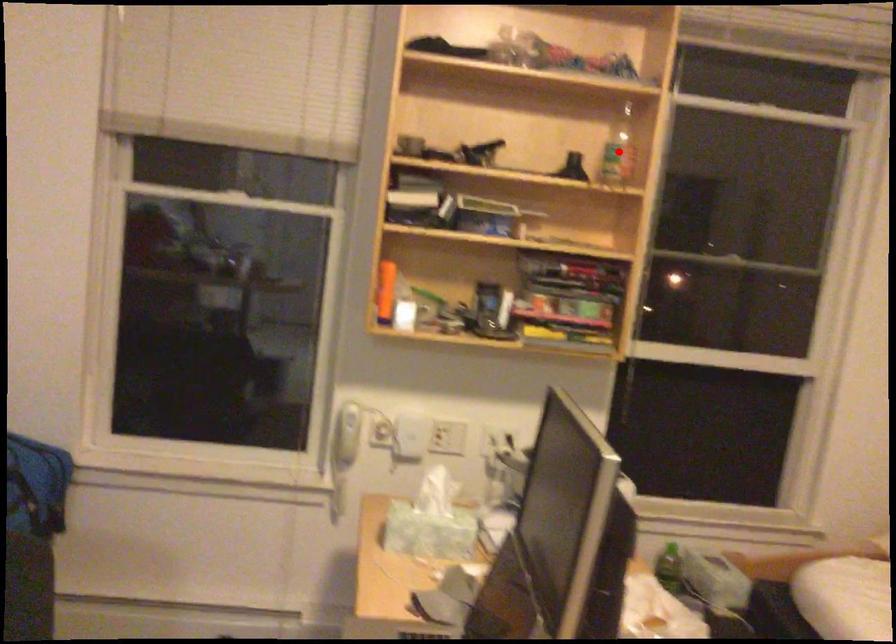
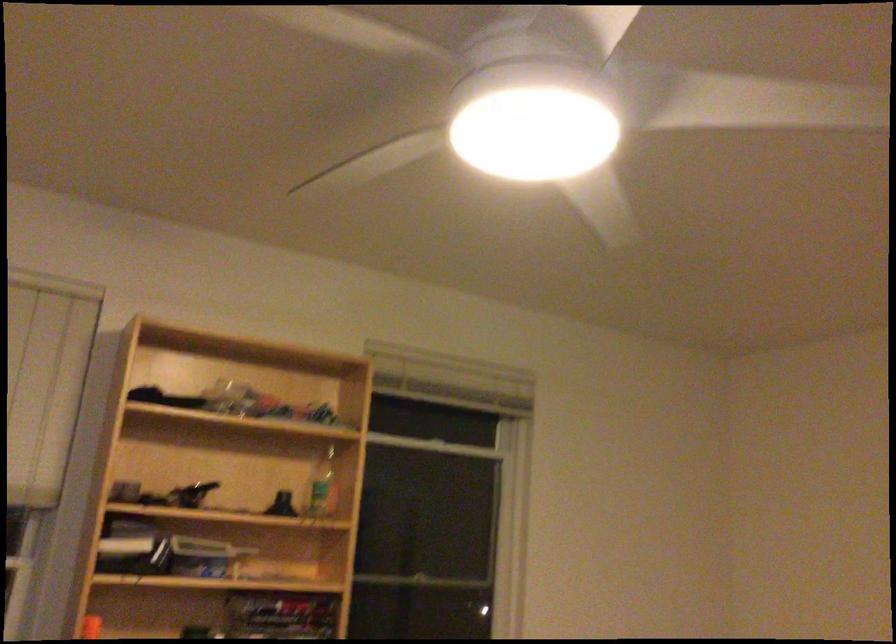
Locate, in the second image, the point that corresponds to the highlighted location in the first image.

(323, 486)